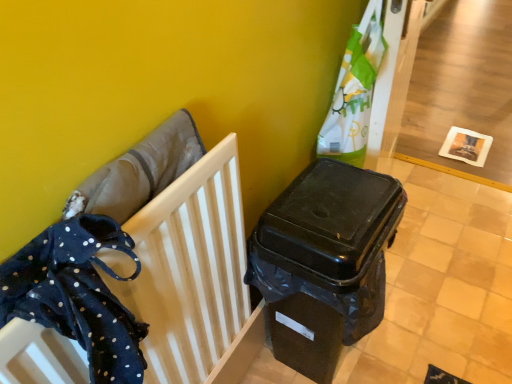
Question: Is dark blue polka dot fabric at left located within black plastic waste container at center-right?

Choices:
 (A) yes
 (B) no

Answer: (B)

Question: Are black plastic waste container at center-right and dark blue polka dot fabric at left located far from each other?

Choices:
 (A) no
 (B) yes

Answer: (A)

Question: From the image's perspective, is black plastic waste container at center-right below dark blue polka dot fabric at left?

Choices:
 (A) yes
 (B) no

Answer: (A)

Question: Could you tell me if black plastic waste container at center-right is turned towards dark blue polka dot fabric at left?

Choices:
 (A) yes
 (B) no

Answer: (B)

Question: Does black plastic waste container at center-right appear on the left side of dark blue polka dot fabric at left?

Choices:
 (A) yes
 (B) no

Answer: (B)

Question: From the image's perspective, is black plastic waste container at center-right on top of dark blue polka dot fabric at left?

Choices:
 (A) yes
 (B) no

Answer: (B)

Question: Is dark blue fabric at left completely or partially outside of dark blue polka dot fabric at left?

Choices:
 (A) yes
 (B) no

Answer: (A)

Question: Does dark blue fabric at left appear on the left side of dark blue polka dot fabric at left?

Choices:
 (A) yes
 (B) no

Answer: (B)

Question: Is the depth of dark blue fabric at left greater than that of dark blue polka dot fabric at left?

Choices:
 (A) yes
 (B) no

Answer: (A)

Question: Is dark blue fabric at left beside dark blue polka dot fabric at left?

Choices:
 (A) no
 (B) yes

Answer: (B)

Question: Does dark blue fabric at left have a greater width compared to dark blue polka dot fabric at left?

Choices:
 (A) yes
 (B) no

Answer: (B)

Question: Considering the relative sizes of dark blue fabric at left and dark blue polka dot fabric at left in the image provided, is dark blue fabric at left bigger than dark blue polka dot fabric at left?

Choices:
 (A) no
 (B) yes

Answer: (B)

Question: Can you confirm if dark blue fabric at left is taller than black plastic waste container at center-right?

Choices:
 (A) no
 (B) yes

Answer: (A)